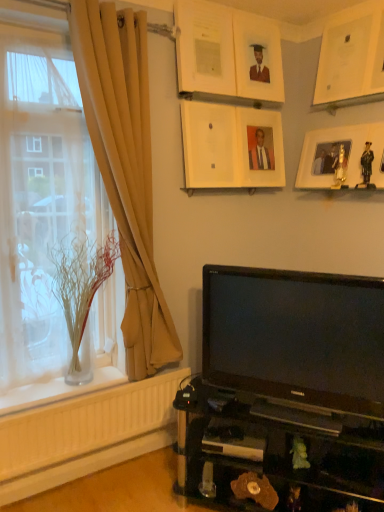
This screenshot has height=512, width=384. What do you see at coordinates (351, 55) in the screenshot?
I see `white matte picture frame at upper right, which ranks as the first picture frame in right-to-left order` at bounding box center [351, 55].

What is the approximate width of white matte picture frame at upper right, which ranks as the first picture frame in right-to-left order?

white matte picture frame at upper right, which ranks as the first picture frame in right-to-left order, is 3.47 inches wide.

I want to click on clear glass vase at left, so click(x=40, y=199).

This screenshot has height=512, width=384. Identify the location of beige fabric curtain at left. point(125,167).

What is the approximate height of beige fabric curtain at left?

The height of beige fabric curtain at left is 5.93 feet.

From the picture: How much space does matte white picture frame at upper center, which is counted as the sixth picture frame, starting from the right, occupy vertically?

18.54 inches.

Where is `matte wooden picture frame at upper center, positioned as the 3th picture frame in right-to-left order`? The height and width of the screenshot is (512, 384). matte wooden picture frame at upper center, positioned as the 3th picture frame in right-to-left order is located at coordinates (260, 148).

Image resolution: width=384 pixels, height=512 pixels. What are the coordinates of `wooden photo frame at upper right, acting as the second picture frame starting from the right` in the screenshot? It's located at (342, 157).

In the scene shown: Considering the relative positions of white matte picture frame at upper right, which ranks as the first picture frame in right-to-left order, and clear glass vase at left in the image provided, is white matte picture frame at upper right, which ranks as the first picture frame in right-to-left order, to the left or to the right of clear glass vase at left?

From the image, it's evident that white matte picture frame at upper right, which ranks as the first picture frame in right-to-left order, is to the right of clear glass vase at left.

Is white matte picture frame at upper right, which ranks as the first picture frame in right-to-left order, looking in the opposite direction of clear glass vase at left?

white matte picture frame at upper right, which ranks as the first picture frame in right-to-left order, does not have its back to clear glass vase at left.

Does point (362, 95) come in front of point (16, 218)?

No.

Image resolution: width=384 pixels, height=512 pixels. There is a clear glass vase at left. Identify the location of the 5th picture frame above it (from the image's perspective). (351, 55).

What's the angular difference between beige fabric curtain at left and white matte picture frame at upper right, which ranks as the first picture frame in right-to-left order,'s facing directions?

90.4 degrees separate the facing orientations of beige fabric curtain at left and white matte picture frame at upper right, which ranks as the first picture frame in right-to-left order.

Between beige fabric curtain at left and white matte picture frame at upper right, which ranks as the 6th picture frame in left-to-right order, which one has larger size?

With larger size is beige fabric curtain at left.

Is beige fabric curtain at left positioned with its back to white matte picture frame at upper right, which ranks as the first picture frame in right-to-left order?

No, beige fabric curtain at left is not facing away from white matte picture frame at upper right, which ranks as the first picture frame in right-to-left order.

Based on their sizes in the image, would you say wooden photo frame at upper right, positioned as the fifth picture frame in left-to-right order, is bigger or smaller than matte white picture frame at upper center, positioned as the fourth picture frame in right-to-left order?

Clearly, wooden photo frame at upper right, positioned as the fifth picture frame in left-to-right order, is larger in size than matte white picture frame at upper center, positioned as the fourth picture frame in right-to-left order.

Considering the sizes of objects wooden photo frame at upper right, positioned as the fifth picture frame in left-to-right order, and matte white picture frame at upper center, the third picture frame from the left, in the image provided, who is wider, wooden photo frame at upper right, positioned as the fifth picture frame in left-to-right order, or matte white picture frame at upper center, the third picture frame from the left,?

Wider between the two is wooden photo frame at upper right, positioned as the fifth picture frame in left-to-right order.

From the image's perspective, between wooden photo frame at upper right, positioned as the fifth picture frame in left-to-right order, and matte white picture frame at upper center, the third picture frame from the left, which one is located above?

matte white picture frame at upper center, the third picture frame from the left, is shown above in the image.

Is wooden photo frame at upper right, positioned as the fifth picture frame in left-to-right order, next to matte white picture frame at upper center, the third picture frame from the left?

wooden photo frame at upper right, positioned as the fifth picture frame in left-to-right order, is not next to matte white picture frame at upper center, the third picture frame from the left, and they're not touching.

Is matte wooden picture frame at upper center, which is the fourth picture frame in left-to-right order, not within white matte picture frame at upper right, which ranks as the first picture frame in right-to-left order?

Absolutely, matte wooden picture frame at upper center, which is the fourth picture frame in left-to-right order, is external to white matte picture frame at upper right, which ranks as the first picture frame in right-to-left order.

Considering the points (260, 157) and (380, 7), which point is in front, point (260, 157) or point (380, 7)?

Point (380, 7)

Measure the distance between matte wooden picture frame at upper center, positioned as the 3th picture frame in right-to-left order, and white matte picture frame at upper right, which ranks as the first picture frame in right-to-left order.

49.60 centimeters.

Is matte wooden picture frame at upper center, which is the fourth picture frame in left-to-right order, far away from white matte picture frame at upper right, which ranks as the 6th picture frame in left-to-right order?

matte wooden picture frame at upper center, which is the fourth picture frame in left-to-right order, is near white matte picture frame at upper right, which ranks as the 6th picture frame in left-to-right order, not far away.

Is wooden photo frame at upper right, positioned as the fifth picture frame in left-to-right order, at the left side of clear glass vase at left?

No.

Who is taller, wooden photo frame at upper right, positioned as the fifth picture frame in left-to-right order, or clear glass vase at left?

With more height is clear glass vase at left.

How much distance is there between wooden photo frame at upper right, acting as the second picture frame starting from the right, and clear glass vase at left?

A distance of 1.43 meters exists between wooden photo frame at upper right, acting as the second picture frame starting from the right, and clear glass vase at left.

Are wooden photo frame at upper right, acting as the second picture frame starting from the right, and clear glass vase at left far apart?

Yes.

Considering the relative sizes of white matte picture frame at upper right, which ranks as the first picture frame in right-to-left order, and matte white picture frame at upper center, the 1th picture frame viewed from the left, in the image provided, is white matte picture frame at upper right, which ranks as the first picture frame in right-to-left order, bigger than matte white picture frame at upper center, the 1th picture frame viewed from the left,?

Yes, white matte picture frame at upper right, which ranks as the first picture frame in right-to-left order, is bigger than matte white picture frame at upper center, the 1th picture frame viewed from the left.

How distant is white matte picture frame at upper right, which ranks as the first picture frame in right-to-left order, from matte white picture frame at upper center, which is counted as the sixth picture frame, starting from the right?

They are 26.76 inches apart.

Would you consider white matte picture frame at upper right, which ranks as the 6th picture frame in left-to-right order, to be distant from matte white picture frame at upper center, the 1th picture frame viewed from the left?

No, white matte picture frame at upper right, which ranks as the 6th picture frame in left-to-right order, is not far away from matte white picture frame at upper center, the 1th picture frame viewed from the left.

Considering the relative positions of white matte picture frame at upper right, which ranks as the 6th picture frame in left-to-right order, and matte white picture frame at upper center, the 1th picture frame viewed from the left, in the image provided, is white matte picture frame at upper right, which ranks as the 6th picture frame in left-to-right order, to the left or to the right of matte white picture frame at upper center, the 1th picture frame viewed from the left,?

Based on their positions, white matte picture frame at upper right, which ranks as the 6th picture frame in left-to-right order, is located to the right of matte white picture frame at upper center, the 1th picture frame viewed from the left.

Could you tell me if white matte picture frame at upper center, acting as the fifth picture frame starting from the right, is facing matte white picture frame at upper center, positioned as the fourth picture frame in right-to-left order?

No, white matte picture frame at upper center, acting as the fifth picture frame starting from the right, is not aimed at matte white picture frame at upper center, positioned as the fourth picture frame in right-to-left order.

Between white matte picture frame at upper center, marked as the 2th picture frame in a left-to-right arrangement, and matte white picture frame at upper center, positioned as the fourth picture frame in right-to-left order, which one has larger size?

Bigger between the two is matte white picture frame at upper center, positioned as the fourth picture frame in right-to-left order.

Which of these two, white matte picture frame at upper center, marked as the 2th picture frame in a left-to-right arrangement, or matte white picture frame at upper center, positioned as the fourth picture frame in right-to-left order, is thinner?

With smaller width is white matte picture frame at upper center, marked as the 2th picture frame in a left-to-right arrangement.

How many degrees apart are the facing directions of white matte picture frame at upper center, marked as the 2th picture frame in a left-to-right arrangement, and matte white picture frame at upper center, positioned as the fourth picture frame in right-to-left order?

white matte picture frame at upper center, marked as the 2th picture frame in a left-to-right arrangement, and matte white picture frame at upper center, positioned as the fourth picture frame in right-to-left order, are facing 1.79 degrees away from each other.

From the image's perspective, starting from the clear glass vase at left, which picture frame is the 5th one above? Please provide its 2D coordinates.

[(351, 55)]

Which picture frame is the 6th one when counting from the right side of the beige fabric curtain at left? Please provide its 2D coordinates.

[(351, 55)]

Looking at the image, which one is located further to black glossy tv at lower right, white matte picture frame at upper center, marked as the 2th picture frame in a left-to-right arrangement, or beige fabric curtain at left?

Among the two, white matte picture frame at upper center, marked as the 2th picture frame in a left-to-right arrangement, is located further to black glossy tv at lower right.

Looking at the image, which one is located closer to white matte picture frame at upper right, which ranks as the 6th picture frame in left-to-right order, matte white picture frame at upper center, which is counted as the sixth picture frame, starting from the right, or beige fabric curtain at left?

Among the two, matte white picture frame at upper center, which is counted as the sixth picture frame, starting from the right, is located nearer to white matte picture frame at upper right, which ranks as the 6th picture frame in left-to-right order.

Which object lies further to the anchor point matte wooden picture frame at upper center, which is the fourth picture frame in left-to-right order, beige fabric curtain at left or matte white picture frame at upper center, positioned as the fourth picture frame in right-to-left order?

beige fabric curtain at left is positioned further to the anchor matte wooden picture frame at upper center, which is the fourth picture frame in left-to-right order.

From the image, which object appears to be farther from white matte picture frame at upper right, which ranks as the 6th picture frame in left-to-right order, matte white picture frame at upper center, positioned as the fourth picture frame in right-to-left order, or black glossy tv at lower right?

black glossy tv at lower right lies further to white matte picture frame at upper right, which ranks as the 6th picture frame in left-to-right order, than the other object.

Looking at the image, which one is located further to black glossy tv at lower right, matte white picture frame at upper center, the 1th picture frame viewed from the left, or clear glass vase at left?

The object further to black glossy tv at lower right is matte white picture frame at upper center, the 1th picture frame viewed from the left.

Based on their spatial positions, is beige fabric curtain at left or clear glass vase at left further from matte white picture frame at upper center, the third picture frame from the left?

clear glass vase at left.

When comparing their distances from matte white picture frame at upper center, the 1th picture frame viewed from the left, does clear glass vase at left or beige fabric curtain at left seem further?

Based on the image, clear glass vase at left appears to be further to matte white picture frame at upper center, the 1th picture frame viewed from the left.

Which object lies further to the anchor point white matte picture frame at upper center, marked as the 2th picture frame in a left-to-right arrangement, white matte picture frame at upper right, which ranks as the 6th picture frame in left-to-right order, or beige fabric curtain at left?

Based on the image, white matte picture frame at upper right, which ranks as the 6th picture frame in left-to-right order, appears to be further to white matte picture frame at upper center, marked as the 2th picture frame in a left-to-right arrangement.

Find the location of `glass vase between clear glass vase at left and white matte picture frame at upper right, which ranks as the first picture frame in right-to-left order, in the horizontal direction`. glass vase between clear glass vase at left and white matte picture frame at upper right, which ranks as the first picture frame in right-to-left order, in the horizontal direction is located at coordinates (80, 285).

At what (x,y) coordinates should I click in order to perform the action: click on curtain situated between clear glass vase at left and matte white picture frame at upper center, the third picture frame from the left, from left to right. Please return your answer as a coordinate pair (x, y). The height and width of the screenshot is (512, 384). Looking at the image, I should click on (125, 167).

You are a GUI agent. You are given a task and a screenshot of the screen. Output one action in this format:
    pyautogui.click(x=<x>, y=<y>)
    Task: Click on the picture frame situated between clear glass vase at left and white matte picture frame at upper center, marked as the 2th picture frame in a left-to-right arrangement, from left to right
    This screenshot has width=384, height=512.
    Given the screenshot: What is the action you would take?
    pyautogui.click(x=204, y=48)

Where is `curtain that lies between matte white picture frame at upper center, the third picture frame from the left, and black glossy tv at lower right from top to bottom`? This screenshot has width=384, height=512. curtain that lies between matte white picture frame at upper center, the third picture frame from the left, and black glossy tv at lower right from top to bottom is located at coordinates (125, 167).